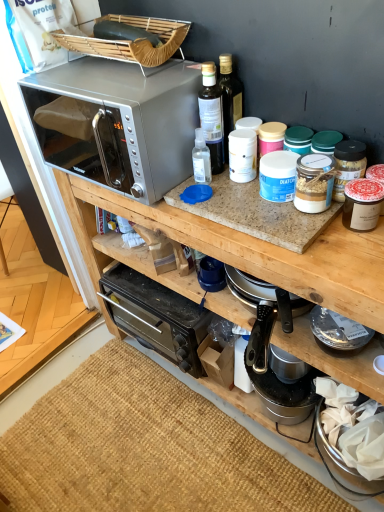
The image size is (384, 512). I want to click on free spot above burlap mat at lower center (from a real-world perspective), so click(135, 452).